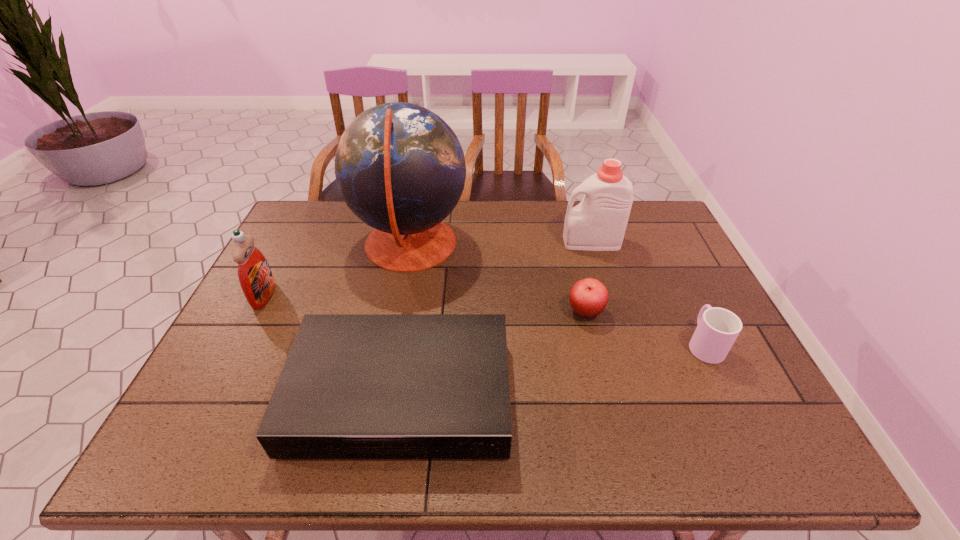
Locate an element on the screen. object that is positioned at the left edge is located at coordinates (256, 279).

I want to click on object present at the right edge, so click(717, 329).

Identify the location of vacant space at the far edge. The height and width of the screenshot is (540, 960). (x=473, y=216).

Where is `vacant space at the near edge of the desktop`? vacant space at the near edge of the desktop is located at coordinates (543, 423).

At what (x,y) coordinates should I click in order to perform the action: click on vacant area at the left edge of the desktop. Please return your answer as a coordinate pair (x, y). Image resolution: width=960 pixels, height=540 pixels. Looking at the image, I should click on (321, 248).

The width and height of the screenshot is (960, 540). In the image, there is a desktop. What are the coordinates of `vacant space at the right edge` in the screenshot? It's located at (721, 398).

You are a GUI agent. You are given a task and a screenshot of the screen. Output one action in this format:
    pyautogui.click(x=<x>, y=<y>)
    Task: Click on the free space at the far left corner
    This screenshot has width=960, height=540.
    Given the screenshot: What is the action you would take?
    pyautogui.click(x=299, y=228)

In order to click on free space at the near right corner in this screenshot , I will do `click(780, 462)`.

Locate an element on the screen. The height and width of the screenshot is (540, 960). vacant space in between the apple and the tallest object is located at coordinates (498, 279).

Identify the location of free space between the apple and the cup. Image resolution: width=960 pixels, height=540 pixels. (644, 328).